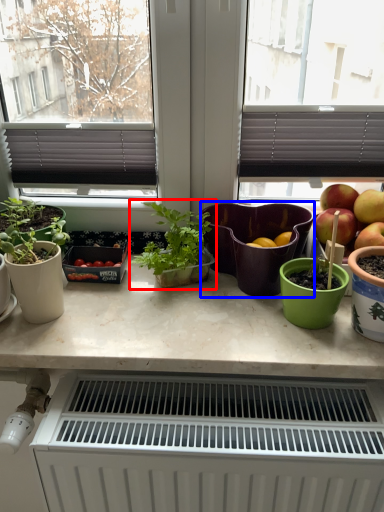
Question: Which of the following is the closest to the observer, houseplant (highlighted by a red box) or flowerpot (highlighted by a blue box)?

Choices:
 (A) houseplant
 (B) flowerpot

Answer: (A)